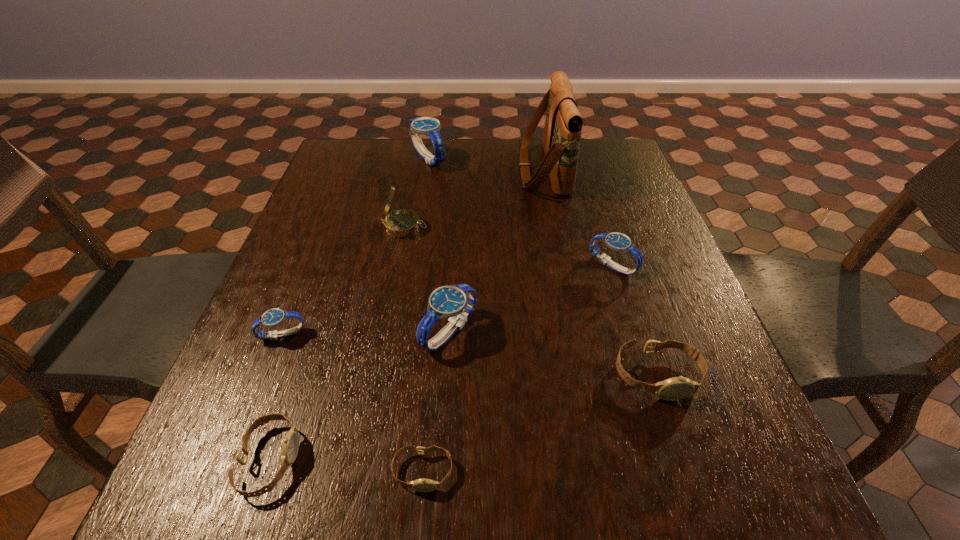
Locate which beige watch is the second closest to the farthest beige watch. Please provide its 2D coordinates. Your answer should be formatted as a tuple, i.e. [(x, y)], where the tuple contains the x and y coordinates of a point satisfying the conditions above.

[(290, 446)]

Locate which beige watch is the closest to the smallest beige watch. Please provide its 2D coordinates. Your answer should be formatted as a tuple, i.e. [(x, y)], where the tuple contains the x and y coordinates of a point satisfying the conditions above.

[(290, 446)]

Identify the location of vacant space that satisfies the following two spatial constraints: 1. with the dial facing the third nearest blue watch; 2. on the right side of the third farthest object. (396, 266).

Where is `blank space that satisfies the following two spatial constraints: 1. on the back side of the rightmost blue watch; 2. with the dial facing the seventh nearest object`? blank space that satisfies the following two spatial constraints: 1. on the back side of the rightmost blue watch; 2. with the dial facing the seventh nearest object is located at coordinates (600, 227).

At what (x,y) coordinates should I click in order to perform the action: click on vacant position in the image that satisfies the following two spatial constraints: 1. on the front-facing side of the shoulder bag; 2. on the face of the smallest beige watch. Please return your answer as a coordinate pair (x, y). This screenshot has height=540, width=960. Looking at the image, I should click on 601,471.

Where is `vacant area in the image that satisfies the following two spatial constraints: 1. with the dial facing the compass; 2. on the front side of the leftmost blue watch`? vacant area in the image that satisfies the following two spatial constraints: 1. with the dial facing the compass; 2. on the front side of the leftmost blue watch is located at coordinates (383, 335).